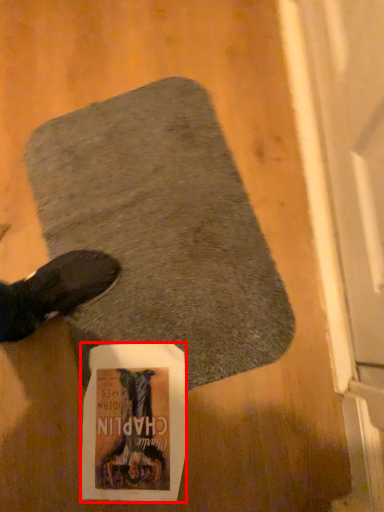
Question: Considering the relative positions of flyer (annotated by the red box) and mat in the image provided, where is flyer (annotated by the red box) located with respect to the staircase?

Choices:
 (A) left
 (B) right

Answer: (A)